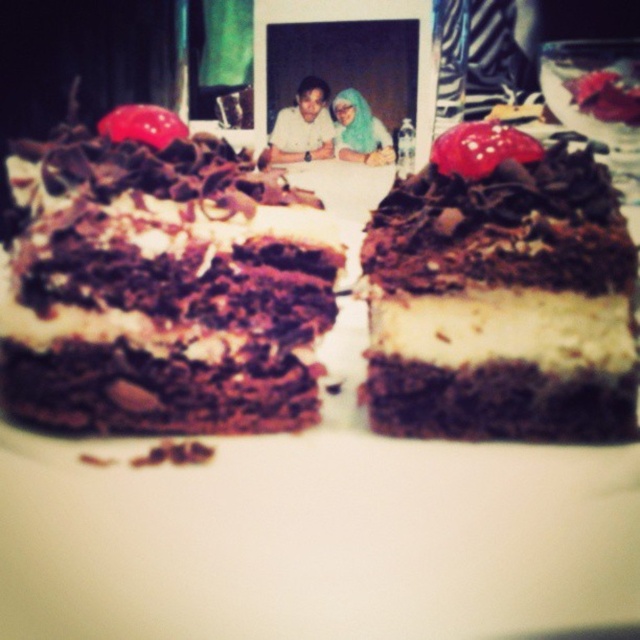
Does chocolatecrumblycake at center have a lesser height compared to matte white shirt at center?

No, chocolatecrumblycake at center is not shorter than matte white shirt at center.

Between chocolatecrumblycake at center and matte white shirt at center, which one appears on the right side from the viewer's perspective?

matte white shirt at center is more to the right.

Consider the image. Who is more forward, (x=268, y=371) or (x=305, y=138)?

Point (x=268, y=371) is in front.

Identify the location of chocolatecrumblycake at center. (161, 284).

This screenshot has width=640, height=640. Find the location of `chocolatecrumblycake at center`. chocolatecrumblycake at center is located at coordinates (161, 284).

The height and width of the screenshot is (640, 640). What do you see at coordinates (161, 284) in the screenshot?
I see `chocolatecrumblycake at center` at bounding box center [161, 284].

The width and height of the screenshot is (640, 640). What do you see at coordinates (161, 284) in the screenshot?
I see `chocolatecrumblycake at center` at bounding box center [161, 284].

Where is `chocolatecrumblycake at center`? chocolatecrumblycake at center is located at coordinates (161, 284).

Which of these two, chocolatecrumblycake at center or chocolatesmoothcake at center, stands taller?

chocolatecrumblycake at center is taller.

Is point (296, 212) closer to viewer compared to point (568, 355)?

No, it is not.

In order to click on chocolatecrumblycake at center in this screenshot , I will do `click(161, 284)`.